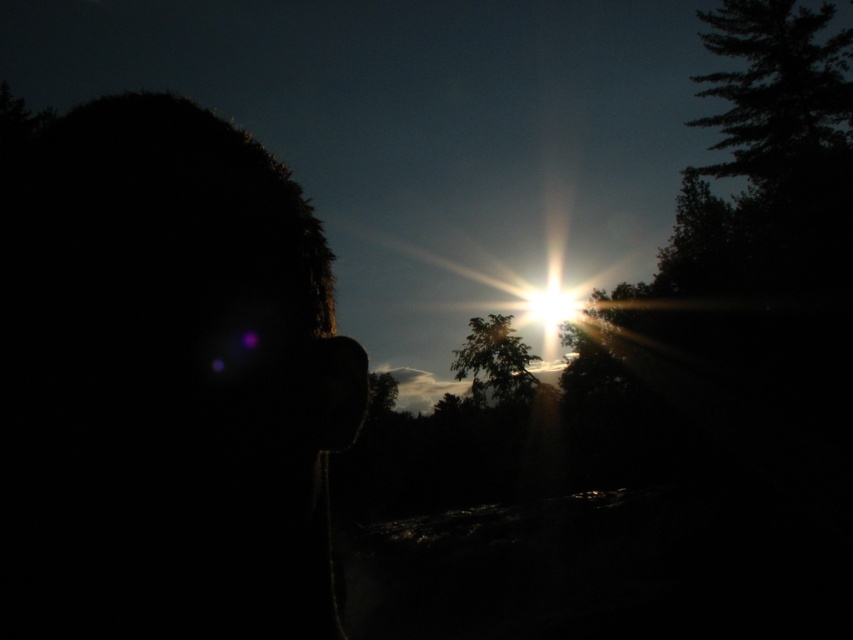
Based on the photo, can you confirm if green leafy tree at center is thinner than bright sun at center?

Correct, green leafy tree at center's width is less than bright sun at center's.

Who is positioned more to the right, green leafy tree at center or bright sun at center?

bright sun at center is more to the right.

This screenshot has width=853, height=640. Identify the location of green leafy tree at center. (494, 360).

Can you confirm if silhouette head at left is positioned to the left of bright sun at center?

Correct, you'll find silhouette head at left to the left of bright sun at center.

Is silhouette head at left behind bright sun at center?

That is False.

Between point (206, 330) and point (543, 324), which one is positioned in front?

Positioned in front is point (206, 330).

This screenshot has height=640, width=853. Find the location of `silhouette head at left`. silhouette head at left is located at coordinates (164, 381).

Can you confirm if silhouette head at left is positioned below green leafy tree at center?

No.

Measure the distance between point [10,566] and camera.

The distance of point [10,566] from camera is 16.22 inches.

This screenshot has width=853, height=640. I want to click on silhouette head at left, so click(164, 381).